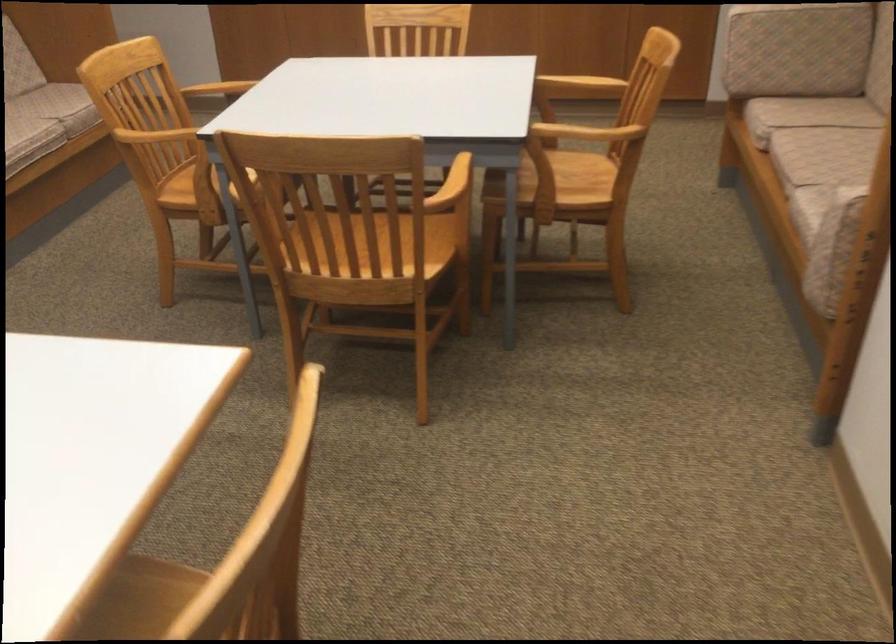
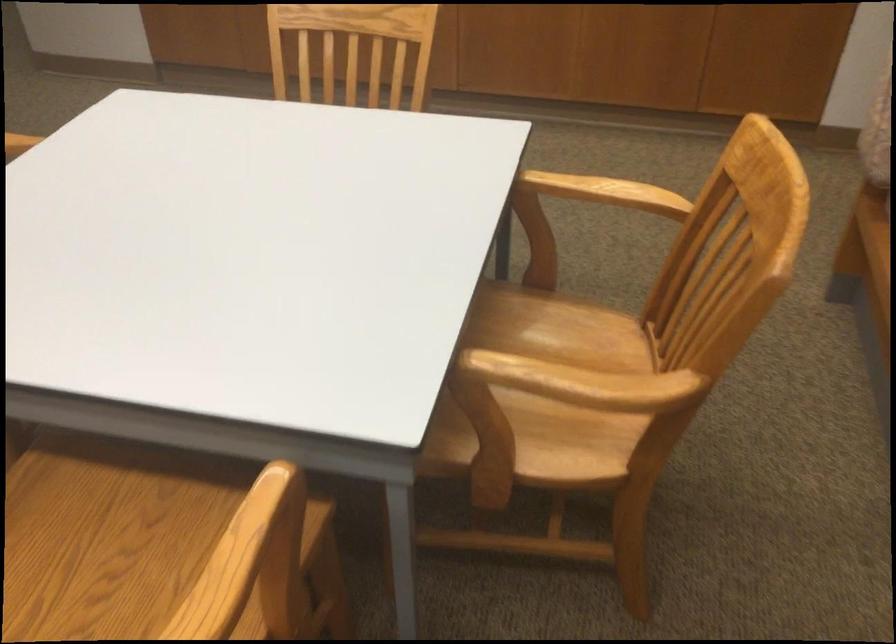
Locate, in the second image, the point that corresponds to point 570,156 in the first image.

(567, 330)